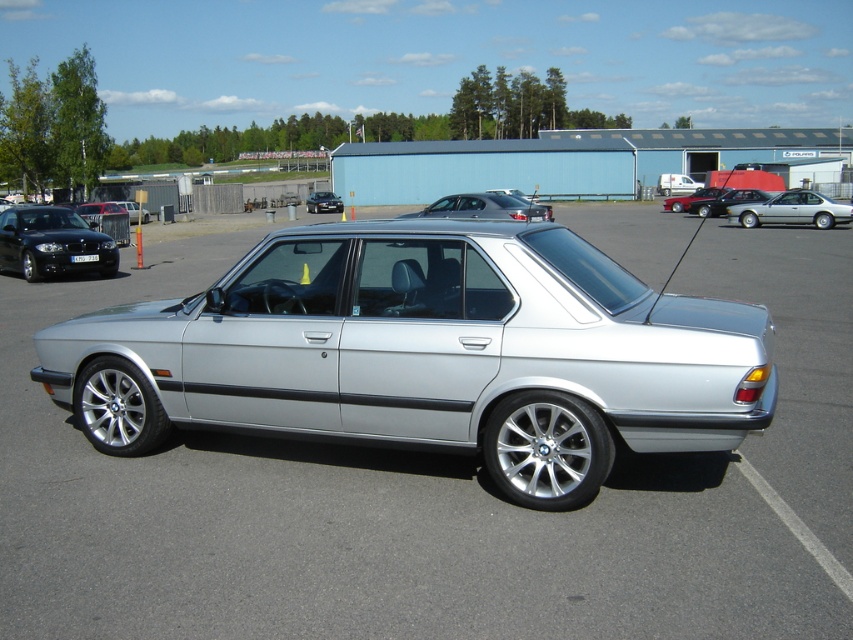
Who is shorter, silver metallic car at center or silver metallic sedan at center?

silver metallic sedan at center

The image size is (853, 640). I want to click on silver metallic car at center, so click(358, 524).

Find the location of a particular element. The width and height of the screenshot is (853, 640). silver metallic car at center is located at coordinates (358, 524).

Find the location of a particular element. Image resolution: width=853 pixels, height=640 pixels. silver metallic car at center is located at coordinates (358, 524).

Does silver metallic sedan at right appear over satin silver sedan at right?

Correct, silver metallic sedan at right is located above satin silver sedan at right.

Is the position of silver metallic sedan at right less distant than that of satin silver sedan at right?

Yes, it is.

Is point (828, 212) positioned after point (726, 196)?

No.

You are a GUI agent. You are given a task and a screenshot of the screen. Output one action in this format:
    pyautogui.click(x=<x>, y=<y>)
    Task: Click on the silver metallic sedan at right
    
    Given the screenshot: What is the action you would take?
    pyautogui.click(x=791, y=211)

Who is higher up, silver metallic sedan at right or matte black sedan at left?

matte black sedan at left is higher up.

Which of these two, silver metallic sedan at right or matte black sedan at left, stands taller?

Standing taller between the two is silver metallic sedan at right.

Is point (817, 211) in front of point (125, 202)?

Yes, it is.

Find the location of a particular element. This screenshot has height=640, width=853. silver metallic sedan at right is located at coordinates (791, 211).